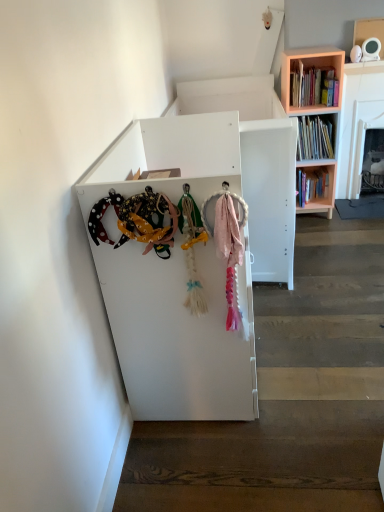
Question: Considering the positions of point (283, 58) and point (309, 94), is point (283, 58) closer or farther from the camera than point (309, 94)?

Choices:
 (A) closer
 (B) farther

Answer: (B)

Question: Considering the positions of pink wooden bookcase at upper right and hardcover books at upper right in the image, is pink wooden bookcase at upper right wider or thinner than hardcover books at upper right?

Choices:
 (A) wide
 (B) thin

Answer: (A)

Question: Considering the real-world distances, which object is closest to the pink wooden bookcase at upper right?

Choices:
 (A) hardcover books at upper right
 (B) pink fabric at lower right

Answer: (A)

Question: Considering the real-world distances, which object is closest to the pink wooden bookcase at upper right?

Choices:
 (A) pink fabric at lower right
 (B) hardcover books at upper right

Answer: (B)